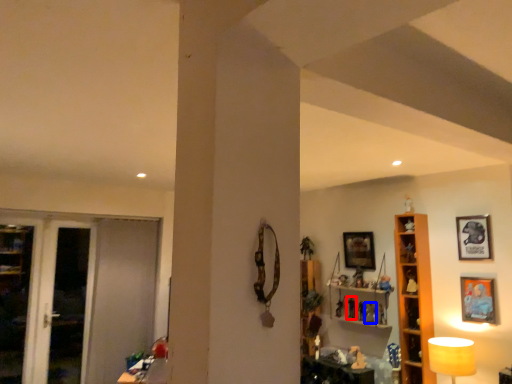
Question: Which object is further to the camera taking this photo, toy (highlighted by a red box) or toy (highlighted by a blue box)?

Choices:
 (A) toy
 (B) toy

Answer: (A)